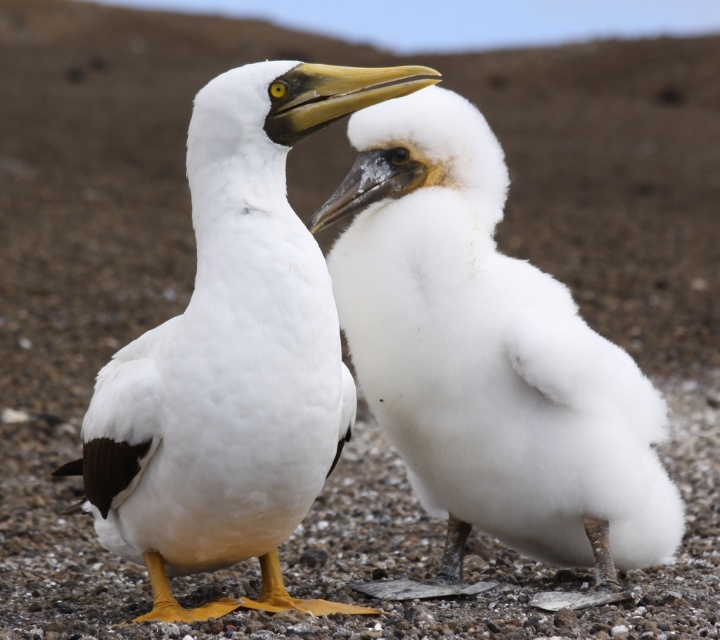
Question: Considering the real-world distances, which object is closest to the matte yellow beak at center?

Choices:
 (A) matte white beak at center
 (B) white matte bird at center
 (C) white fluffy bird at center

Answer: (A)

Question: Does white fluffy bird at center have a smaller size compared to white matte bird at center?

Choices:
 (A) yes
 (B) no

Answer: (A)

Question: Which object is closer to the camera taking this photo?

Choices:
 (A) white fluffy bird at center
 (B) matte white beak at center
 (C) matte yellow beak at center
 (D) white matte bird at center

Answer: (D)

Question: Which point is closer to the camera taking this photo?

Choices:
 (A) (423, 109)
 (B) (315, 67)

Answer: (B)

Question: Does white fluffy bird at center appear on the right side of matte yellow beak at center?

Choices:
 (A) no
 (B) yes

Answer: (B)

Question: Is white fluffy bird at center to the right of matte white beak at center from the viewer's perspective?

Choices:
 (A) no
 (B) yes

Answer: (B)